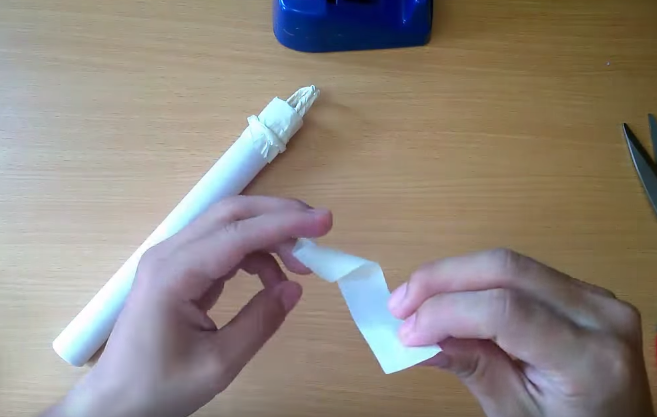
Identify the location of table. (407, 133).